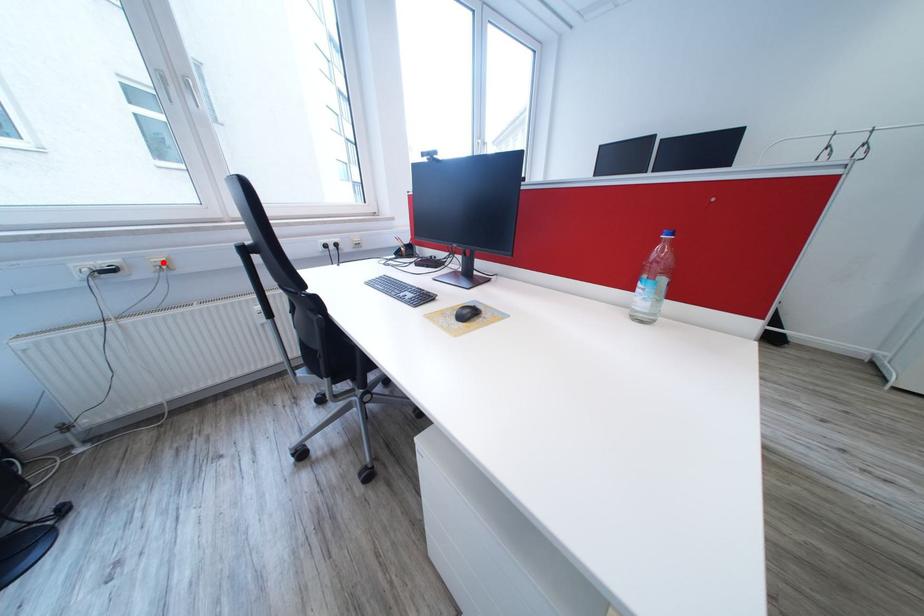
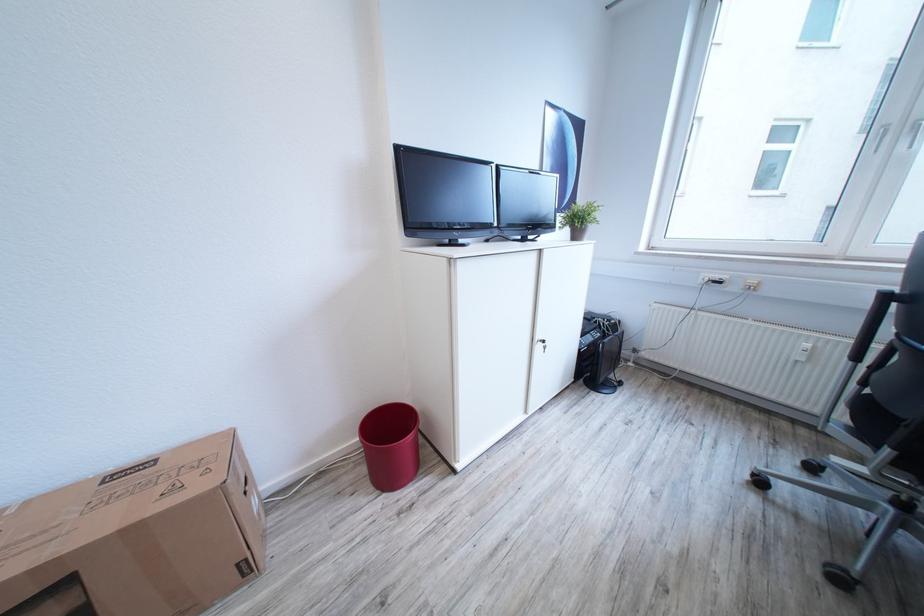
Question: I am providing you with two images of the same scene from different viewpoints. A red point is marked on the first image. Is the red point's position out of view in image 2?

Choices:
 (A) Yes
 (B) No

Answer: (B)